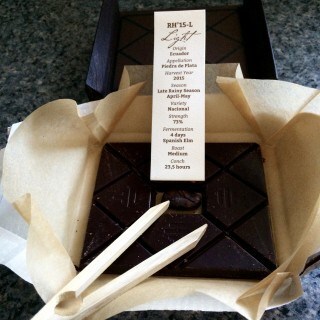
Where is `table`? This screenshot has width=320, height=320. table is located at coordinates (44, 77).